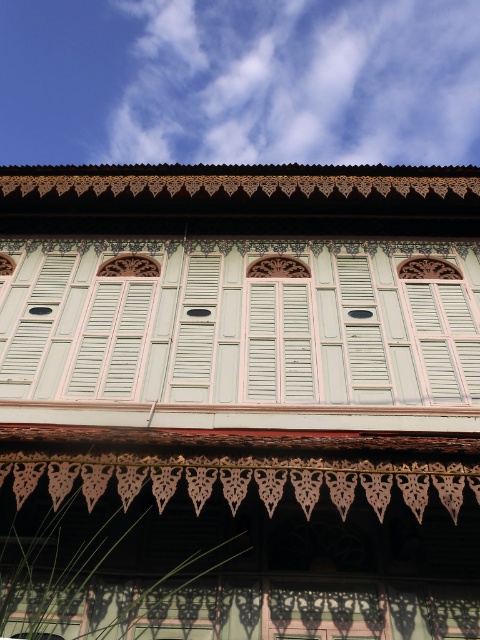
Question: Is white fluffy cloud at upper center positioned behind light green wood at center?

Choices:
 (A) yes
 (B) no

Answer: (A)

Question: Among these objects, which one is nearest to the camera?

Choices:
 (A) light green wood at center
 (B) light green wood shutters at center
 (C) white matte shutters at center
 (D) white fluffy cloud at upper center

Answer: (C)

Question: Which is farther from the white matte shutters at center?

Choices:
 (A) light green wood shutters at center
 (B) light green wood at center

Answer: (A)

Question: Which of the following is the farthest from the observer?

Choices:
 (A) light green wood shutters at center
 (B) white fluffy cloud at upper center
 (C) light green wood at center
 (D) white matte shutters at center

Answer: (B)

Question: Is light green wood shutters at center to the left of white matte shutters at center from the viewer's perspective?

Choices:
 (A) no
 (B) yes

Answer: (B)

Question: Does white fluffy cloud at upper center appear under light green wood at center?

Choices:
 (A) no
 (B) yes

Answer: (A)